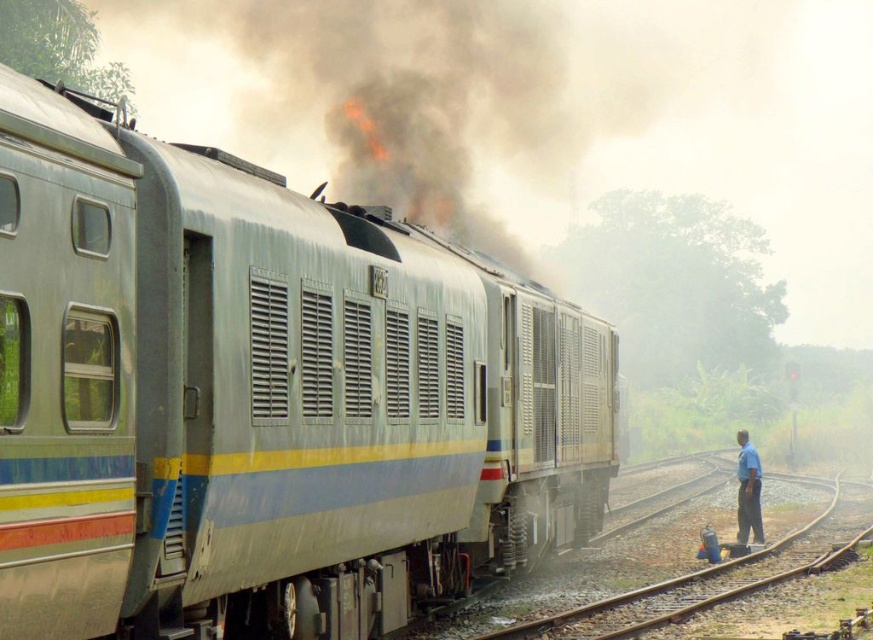
Question: Can you confirm if metallic train at left is positioned to the left of blue shirt at right?

Choices:
 (A) yes
 (B) no

Answer: (A)

Question: Which point is closer to the camera taking this photo?

Choices:
 (A) (746, 470)
 (B) (168, 278)

Answer: (B)

Question: Which point is closer to the camera?

Choices:
 (A) metallic train at left
 (B) blue shirt at right

Answer: (A)

Question: Can you confirm if metallic train at left is positioned below blue shirt at right?

Choices:
 (A) yes
 (B) no

Answer: (B)

Question: Does metallic train at left have a greater width compared to blue shirt at right?

Choices:
 (A) yes
 (B) no

Answer: (A)